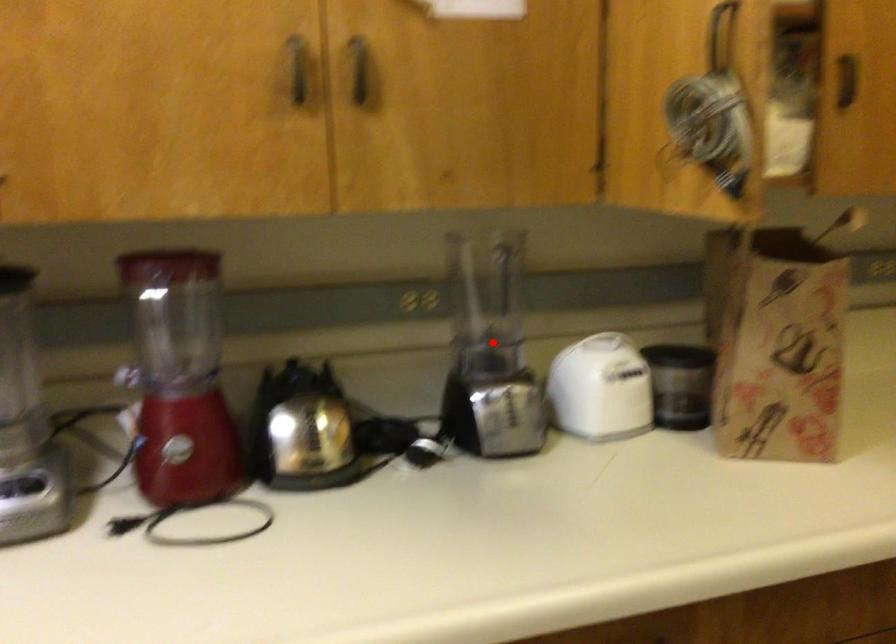
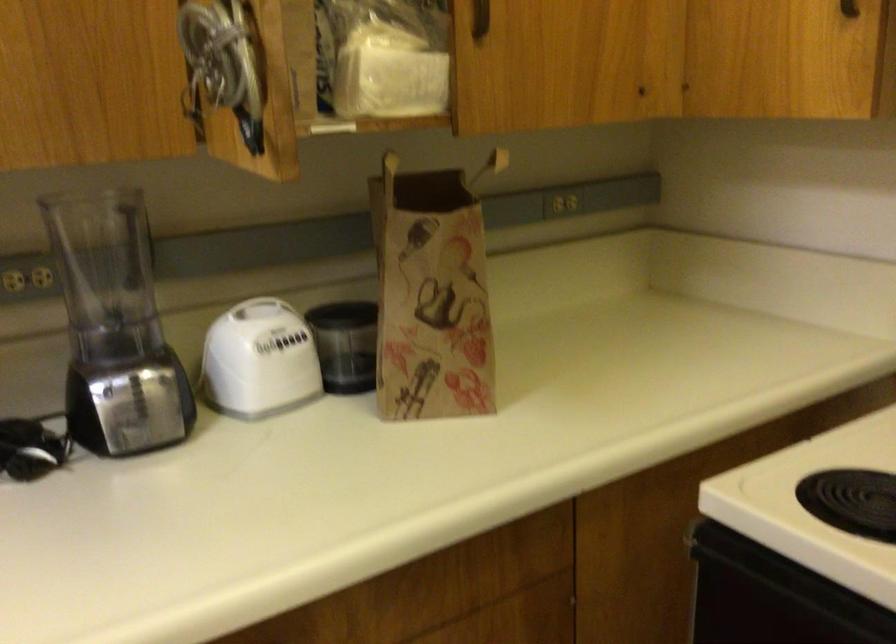
Question: I am providing you with two images of the same scene from different viewpoints. In image1, a red point is highlighted. Considering the same 3D point in image2, which of the following is correct?

Choices:
 (A) It is closer
 (B) It is farther

Answer: (A)